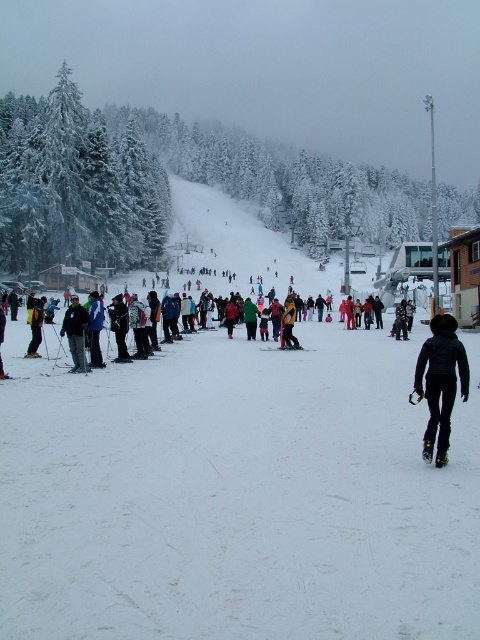
Question: Considering the real-world distances, which object is closest to the dark blue jacket at center?

Choices:
 (A) matte black ski at lower left
 (B) matte yellow jacket at left
 (C) black matte ski at center

Answer: (A)

Question: Is dark blue jacket at center above matte yellow jacket at left?

Choices:
 (A) yes
 (B) no

Answer: (B)

Question: Does dark blue jacket at center appear on the left side of matte yellow jacket at left?

Choices:
 (A) yes
 (B) no

Answer: (B)

Question: Can you confirm if black matte snowboard at lower right is positioned to the right of black matte ski at center?

Choices:
 (A) yes
 (B) no

Answer: (A)

Question: Among these objects, which one is farthest from the camera?

Choices:
 (A) matte black ski at lower left
 (B) dark blue jacket at center
 (C) black matte ski at center
 (D) matte yellow jacket at left

Answer: (C)

Question: Which point is farther to the camera?

Choices:
 (A) (437, 376)
 (B) (72, 353)
 (C) (37, 342)

Answer: (C)